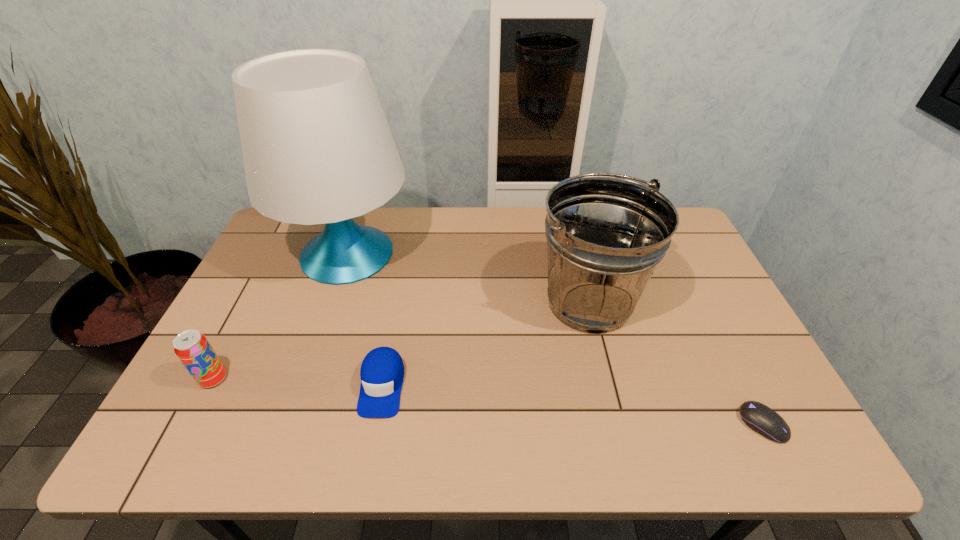
At what (x,y) coordinates should I click in order to perform the action: click on vacant area between the second shortest object and the bucket. Please return your answer as a coordinate pair (x, y). Looking at the image, I should click on (486, 344).

Locate an element on the screen. The height and width of the screenshot is (540, 960). free space between the tallest object and the fourth object from left to right is located at coordinates (468, 278).

Locate an element on the screen. The width and height of the screenshot is (960, 540). free space between the third tallest object and the table lamp is located at coordinates (280, 316).

At what (x,y) coordinates should I click in order to perform the action: click on vacant space that is in between the soda can and the table lamp. Please return your answer as a coordinate pair (x, y). This screenshot has height=540, width=960. Looking at the image, I should click on (280, 316).

Choose which object is the fourth nearest neighbor to the bucket. Please provide its 2D coordinates. Your answer should be formatted as a tuple, i.e. [(x, y)], where the tuple contains the x and y coordinates of a point satisfying the conditions above.

[(193, 349)]

Locate an element on the screen. the closest object to the tallest object is located at coordinates (382, 371).

Where is `vacant area in the image that satisfies the following two spatial constraints: 1. on the front-facing side of the rightmost object; 2. on the right side of the baseball cap`? This screenshot has width=960, height=540. vacant area in the image that satisfies the following two spatial constraints: 1. on the front-facing side of the rightmost object; 2. on the right side of the baseball cap is located at coordinates (374, 424).

At what (x,y) coordinates should I click in order to perform the action: click on vacant position in the image that satisfies the following two spatial constraints: 1. on the back side of the second tallest object; 2. on the front-facing side of the tallest object. Please return your answer as a coordinate pair (x, y). This screenshot has height=540, width=960. Looking at the image, I should click on (576, 253).

The width and height of the screenshot is (960, 540). I want to click on blank area in the image that satisfies the following two spatial constraints: 1. on the front-facing side of the shortest object; 2. on the left side of the table lamp, so click(290, 424).

I want to click on vacant region that satisfies the following two spatial constraints: 1. on the front-facing side of the fourth tallest object; 2. on the left side of the rightmost object, so click(374, 424).